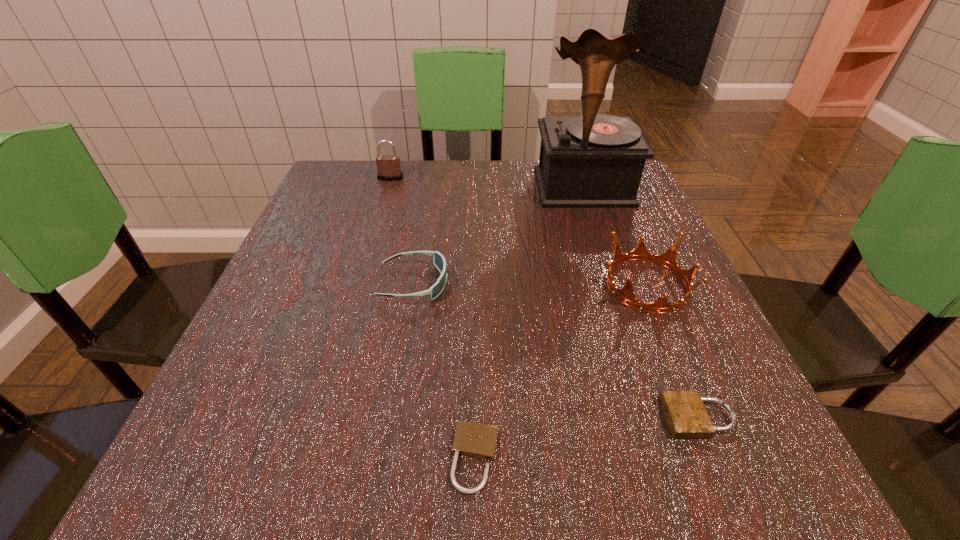
Select which padlock appears as the second closest to the shortest padlock. Please provide its 2D coordinates. Your answer should be formatted as a tuple, i.e. [(x, y)], where the tuple contains the x and y coordinates of a point satisfying the conditions above.

[(388, 166)]

Locate an element on the screen. The image size is (960, 540). vacant space that satisfies the following two spatial constraints: 1. at the horn opening of the phonograph_record; 2. on the left side of the crown is located at coordinates (615, 285).

You are a GUI agent. You are given a task and a screenshot of the screen. Output one action in this format:
    pyautogui.click(x=<x>, y=<y>)
    Task: Click on the free space that satisfies the following two spatial constraints: 1. on the keyhole side of the second shortest object; 2. on the front side of the shortest object
    The image size is (960, 540).
    Given the screenshot: What is the action you would take?
    pyautogui.click(x=715, y=458)

Find the location of a particular element. The image size is (960, 540). free space in the image that satisfies the following two spatial constraints: 1. on the front side of the fourth shortest object; 2. on the keyhole side of the fifth tallest object is located at coordinates (702, 417).

Image resolution: width=960 pixels, height=540 pixels. I want to click on free space that satisfies the following two spatial constraints: 1. on the front-facing side of the fifth object from right to left; 2. on the back side of the crown, so 414,285.

Identify the location of vacant space that satisfies the following two spatial constraints: 1. at the horn opening of the crown; 2. on the right side of the tallest object. The width and height of the screenshot is (960, 540). (615, 285).